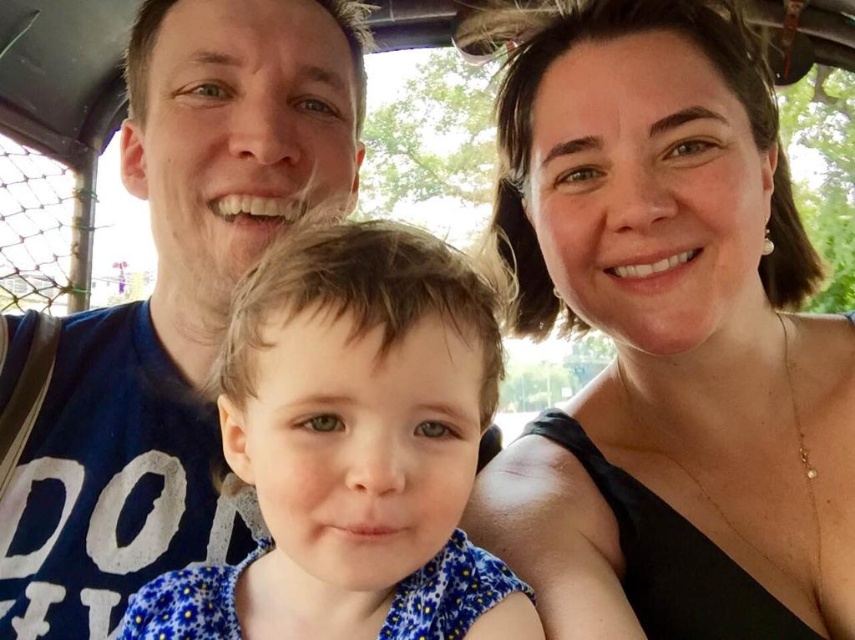
Can you confirm if matte black top at upper right is positioned to the left of blue floral dress at center?

No, matte black top at upper right is not to the left of blue floral dress at center.

Based on the photo, can you confirm if matte black top at upper right is thinner than blue floral dress at center?

No, matte black top at upper right is not thinner than blue floral dress at center.

In order to click on matte black top at upper right in this screenshot , I will do `click(665, 333)`.

Who is taller, matte black top at upper right or blue cotton shirt at left?

Standing taller between the two is matte black top at upper right.

Is point (664, 310) farther from camera compared to point (158, 545)?

No, it is in front of (158, 545).

What are the coordinates of `matte black top at upper right` in the screenshot? It's located at (665, 333).

Find the location of a particular element. This screenshot has width=855, height=640. blue cotton shirt at left is located at coordinates (175, 301).

Can you confirm if blue cotton shirt at left is positioned above blue floral dress at center?

Indeed, blue cotton shirt at left is positioned over blue floral dress at center.

Is point (181, 198) more distant than point (376, 406)?

Yes, point (181, 198) is behind point (376, 406).

Identify the location of blue cotton shirt at left. This screenshot has width=855, height=640. (175, 301).